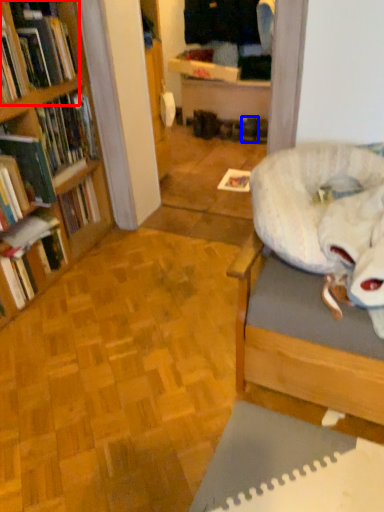
Question: Which of the following is the farthest to the observer, book (highlighted by a red box) or footwear (highlighted by a blue box)?

Choices:
 (A) book
 (B) footwear

Answer: (B)